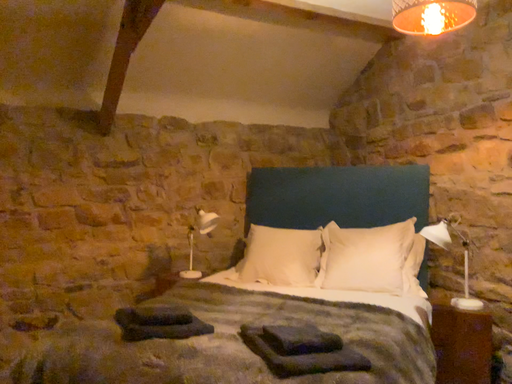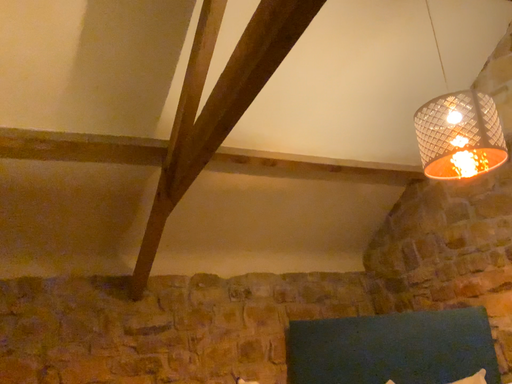
Question: How did the camera likely rotate when shooting the video?

Choices:
 (A) rotated upward
 (B) rotated downward

Answer: (A)